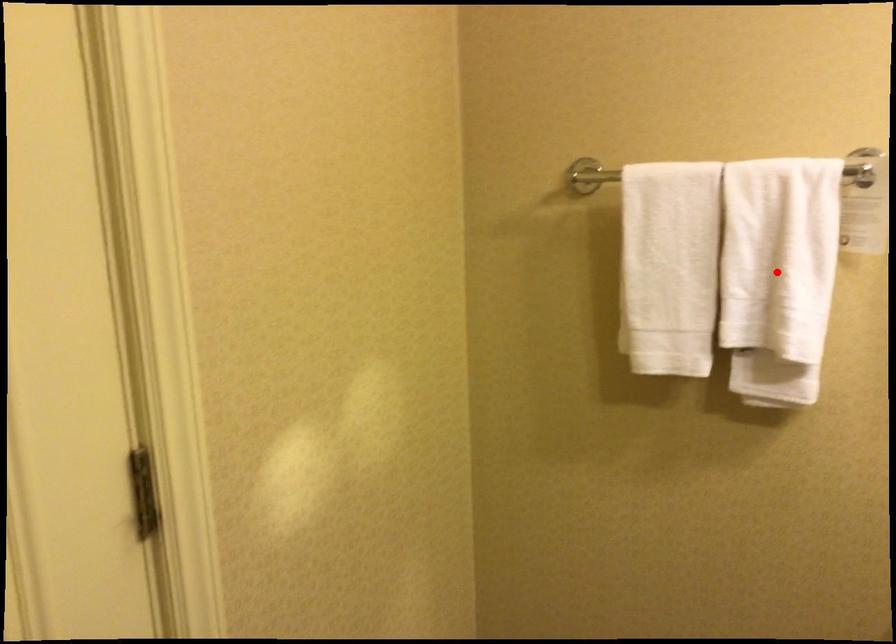
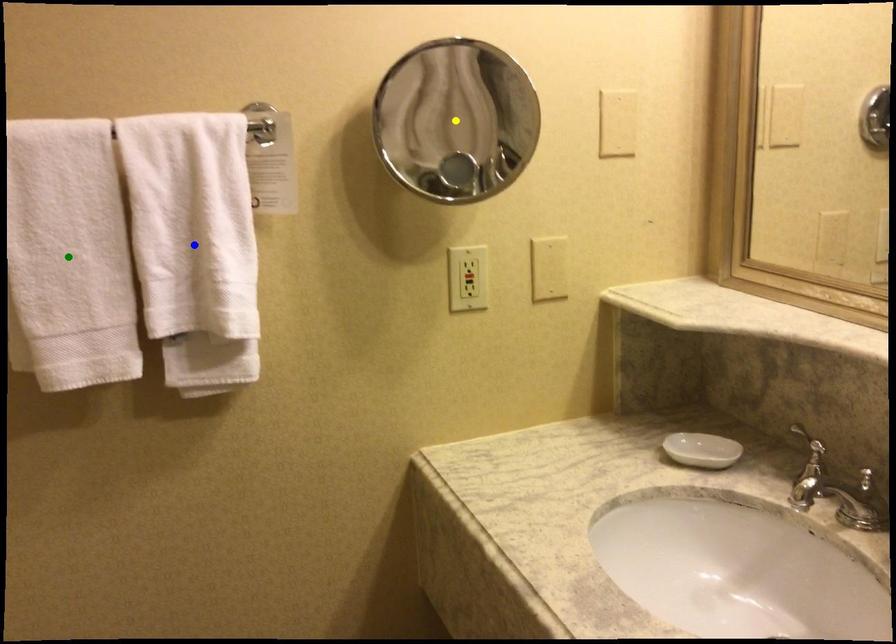
Question: I am providing you with two images of the same scene from different viewpoints. A red point is marked on the first image. You are given multiple points on the second image. Which point in image 2 is actually the same real-world point as the red point in image 1?

Choices:
 (A) green point
 (B) blue point
 (C) yellow point

Answer: (B)